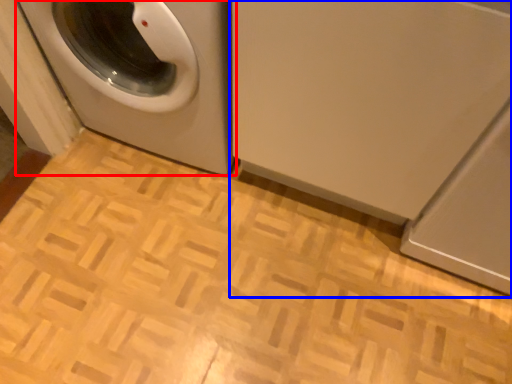
Question: Which object is further to the camera taking this photo, washing machine (highlighted by a red box) or washing machine (highlighted by a blue box)?

Choices:
 (A) washing machine
 (B) washing machine

Answer: (A)